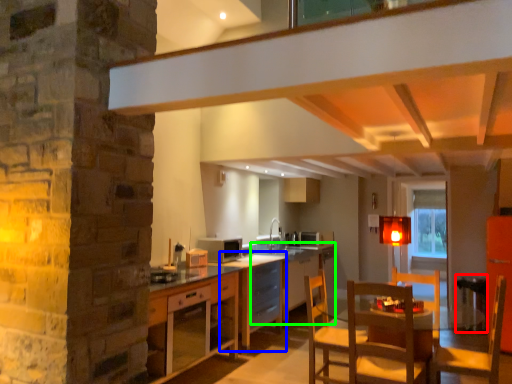
Question: Considering the real-world distances, which object is farthest from bar stool (highlighted by a red box)? table (highlighted by a blue box) or table (highlighted by a green box)?

Choices:
 (A) table
 (B) table

Answer: (B)